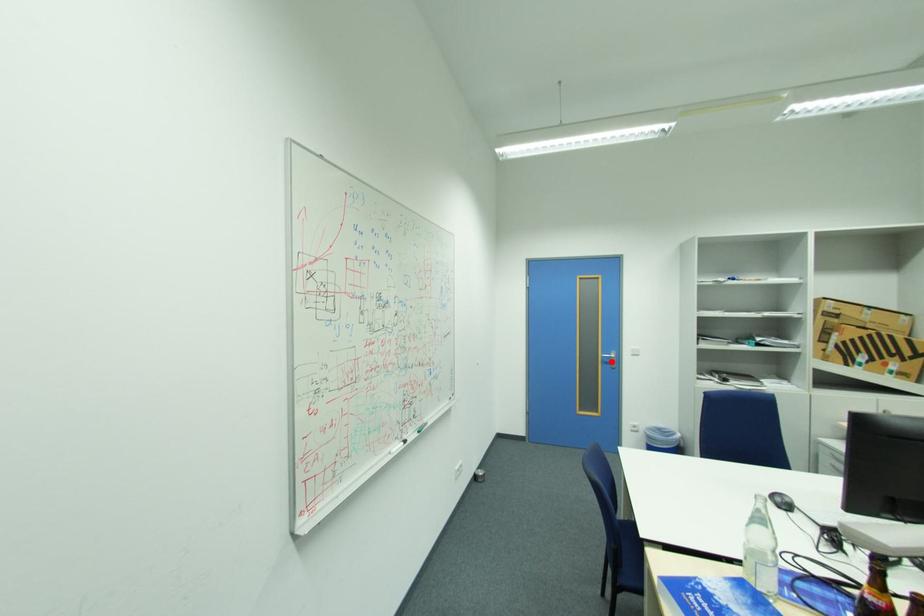
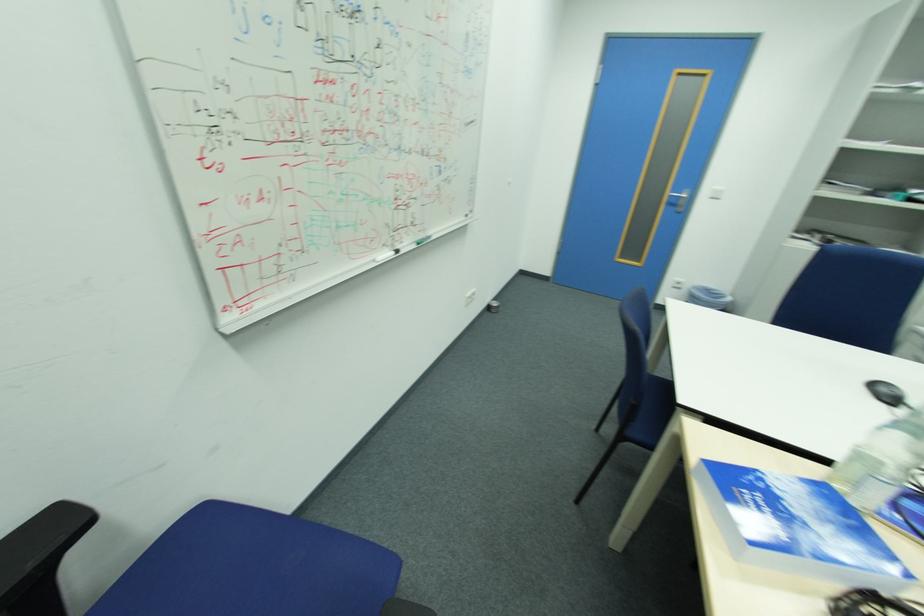
Question: I am providing you with two images of the same scene from different viewpoints. Image1 has a red point marked. In image2, the corresponding 3D location appears at what relative position? Reply with the corresponding letter.

Choices:
 (A) Closer
 (B) Farther

Answer: (A)